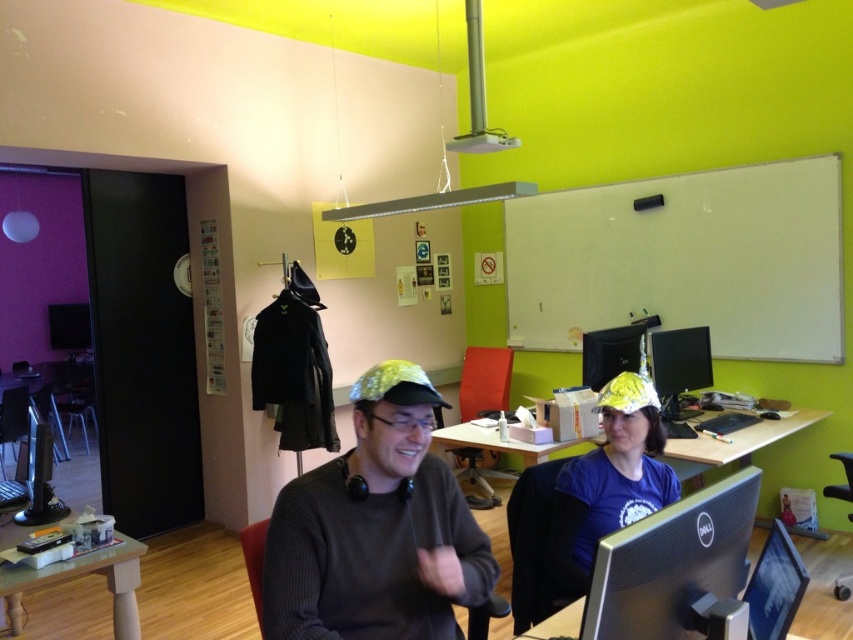
Question: Is matte gold cap at center thinner than black glossy monitor at center?

Choices:
 (A) yes
 (B) no

Answer: (B)

Question: Estimate the real-world distances between objects in this image. Which object is closer to the wooden table at lower left?

Choices:
 (A) black plastic laptop at left
 (B) matte black monitor at center

Answer: (A)

Question: Does blue fabric hat at center appear on the left side of wooden table at lower left?

Choices:
 (A) yes
 (B) no

Answer: (B)

Question: Which point is farther from the camera taking this photo?

Choices:
 (A) (424, 589)
 (B) (740, 456)

Answer: (B)

Question: Is wooden table at lower left below matte black monitor at upper right?

Choices:
 (A) yes
 (B) no

Answer: (A)

Question: Which point is farther to the camera?

Choices:
 (A) black glossy monitor at center
 (B) wooden desk at center
 (C) matte gold cap at center
 (D) wooden table at lower left

Answer: (B)